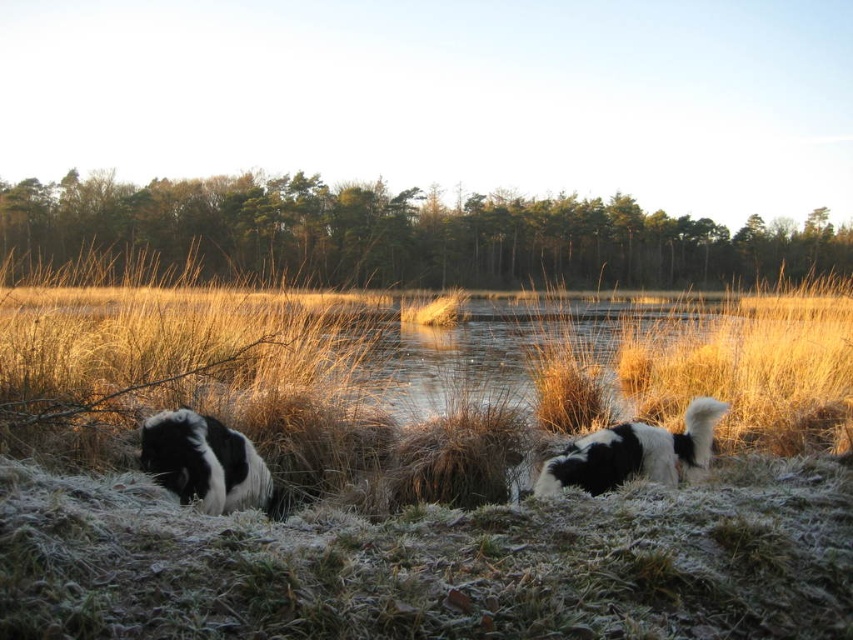
Can you confirm if black and white fur dog at lower left is taller than black and white fur dog at lower right?

Yes.

Can you confirm if black and white fur dog at lower left is positioned above black and white fur dog at lower right?

No.

Does point (212, 444) lie behind point (605, 476)?

Yes, point (212, 444) is farther from viewer.

In order to click on black and white fur dog at lower left in this screenshot , I will do `click(204, 461)`.

Who is higher up, frosted grass at center or black and white fur dog at lower left?

Positioned higher is frosted grass at center.

Which is more to the right, frosted grass at center or black and white fur dog at lower left?

From the viewer's perspective, frosted grass at center appears more on the right side.

Locate an element on the screen. frosted grass at center is located at coordinates pos(370,486).

In order to click on frosted grass at center in this screenshot , I will do `click(370, 486)`.

Is point (781, 564) less distant than point (605, 483)?

Yes, point (781, 564) is in front of point (605, 483).

What are the coordinates of `frosted grass at center` in the screenshot? It's located at (370, 486).